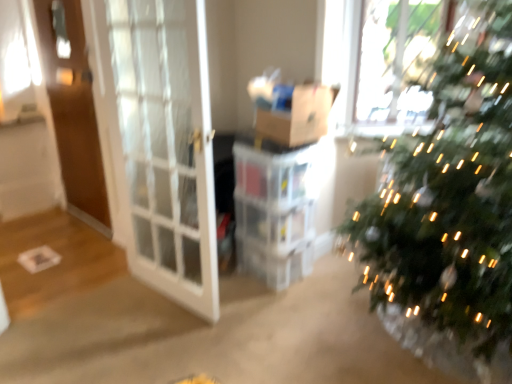
Question: From a real-world perspective, is white glass screen door at left, which appears as the first screen door when viewed from the front, physically below brown cardboard box at center?

Choices:
 (A) no
 (B) yes

Answer: (B)

Question: From a real-world perspective, is white glass screen door at left, which appears as the first screen door when viewed from the front, positioned over brown cardboard box at center based on gravity?

Choices:
 (A) yes
 (B) no

Answer: (B)

Question: Does white glass screen door at left, which appears as the first screen door when viewed from the front, have a greater width compared to brown cardboard box at center?

Choices:
 (A) no
 (B) yes

Answer: (A)

Question: Are white glass screen door at left, which appears as the first screen door when viewed from the front, and brown cardboard box at center beside each other?

Choices:
 (A) no
 (B) yes

Answer: (A)

Question: Does white glass screen door at left, arranged as the second screen door when viewed from the back, contain brown cardboard box at center?

Choices:
 (A) yes
 (B) no

Answer: (B)

Question: Does point (309, 115) appear closer or farther from the camera than point (89, 213)?

Choices:
 (A) closer
 (B) farther

Answer: (A)

Question: Considering the positions of brown cardboard box at center and brown wooden screen door at left, placed as the 1th screen door when sorted from left to right, in the image, is brown cardboard box at center wider or thinner than brown wooden screen door at left, placed as the 1th screen door when sorted from left to right,?

Choices:
 (A) wide
 (B) thin

Answer: (A)

Question: Is brown cardboard box at center taller or shorter than brown wooden screen door at left, acting as the 1th screen door starting from the back?

Choices:
 (A) short
 (B) tall

Answer: (A)

Question: Would you say brown cardboard box at center is to the left or to the right of brown wooden screen door at left, the 2th screen door in the right-to-left sequence, in the picture?

Choices:
 (A) left
 (B) right

Answer: (B)

Question: Considering the positions of brown wooden screen door at left, acting as the 2th screen door starting from the front, and white glass screen door at left, which appears as the first screen door when viewed from the front, in the image, is brown wooden screen door at left, acting as the 2th screen door starting from the front, bigger or smaller than white glass screen door at left, which appears as the first screen door when viewed from the front,?

Choices:
 (A) small
 (B) big

Answer: (A)

Question: In the image, is brown wooden screen door at left, the 2th screen door in the right-to-left sequence, positioned in front of or behind white glass screen door at left, which appears as the first screen door when viewed from the front?

Choices:
 (A) behind
 (B) front

Answer: (A)

Question: Does point (84, 129) appear closer or farther from the camera than point (184, 286)?

Choices:
 (A) farther
 (B) closer

Answer: (A)

Question: Considering the relative positions of brown wooden screen door at left, acting as the 1th screen door starting from the back, and white glass screen door at left, which appears as the first screen door when viewed from the front, in the image provided, is brown wooden screen door at left, acting as the 1th screen door starting from the back, to the left or to the right of white glass screen door at left, which appears as the first screen door when viewed from the front,?

Choices:
 (A) left
 (B) right

Answer: (A)

Question: Is point (200, 286) positioned closer to the camera than point (318, 127)?

Choices:
 (A) closer
 (B) farther

Answer: (A)

Question: From a real-world perspective, relative to brown cardboard box at center, is white glass screen door at left, arranged as the second screen door when viewed from the back, vertically above or below?

Choices:
 (A) above
 (B) below

Answer: (B)